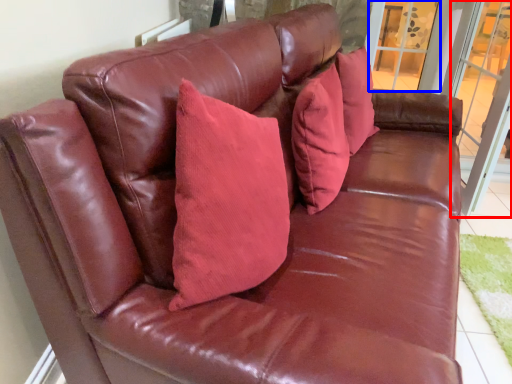
Question: Which point is closer to the camera, screen door (highlighted by a red box) or window (highlighted by a blue box)?

Choices:
 (A) screen door
 (B) window

Answer: (A)